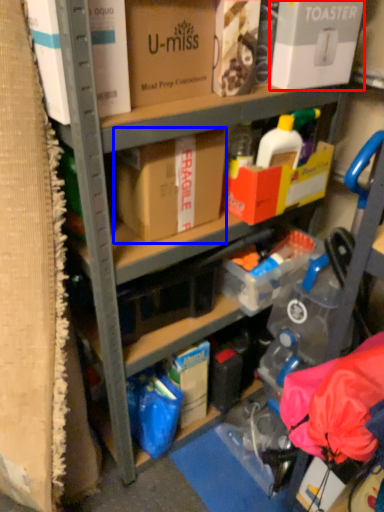
Question: Which point is closer to the camera, box (highlighted by a red box) or box (highlighted by a blue box)?

Choices:
 (A) box
 (B) box

Answer: (A)